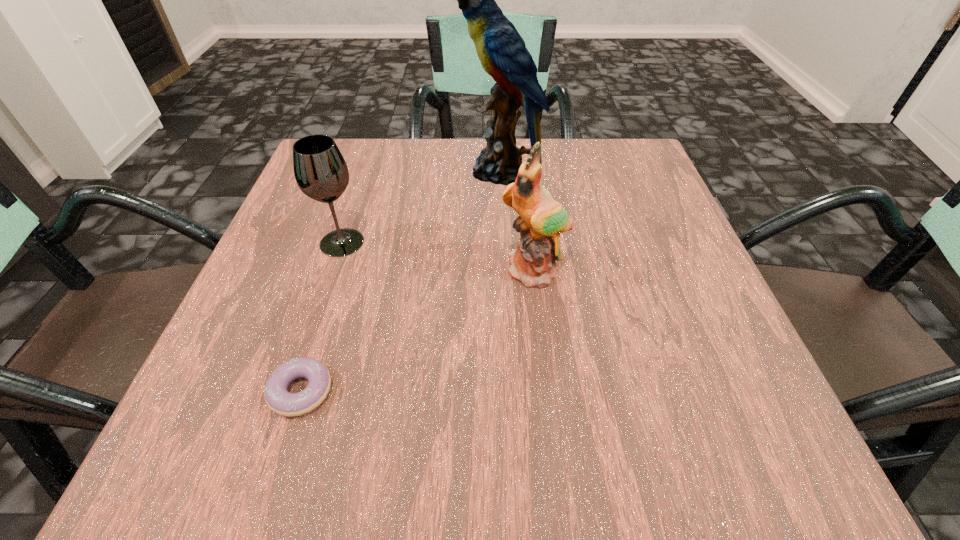
This screenshot has width=960, height=540. I want to click on free space between the shortest object and the shorter parrot, so pyautogui.click(x=418, y=331).

What are the coordinates of `free space that is in between the nearer parrot and the second shortest object` in the screenshot? It's located at (438, 256).

What are the coordinates of `free space between the third tallest object and the doughnut` in the screenshot? It's located at (322, 316).

You are a GUI agent. You are given a task and a screenshot of the screen. Output one action in this format:
    pyautogui.click(x=<x>, y=<y>)
    Task: Click on the unoccupied position between the taller parrot and the wineglass
    
    Given the screenshot: What is the action you would take?
    pyautogui.click(x=421, y=207)

The width and height of the screenshot is (960, 540). I want to click on object that is the second closest to the third tallest object, so click(x=279, y=400).

The image size is (960, 540). What are the coordinates of `object that is the second closest to the nearer parrot` in the screenshot? It's located at (320, 170).

Where is `vacant region that satisfies the following two spatial constraints: 1. on the front side of the nearest object; 2. on the left side of the second shortest object`? This screenshot has height=540, width=960. vacant region that satisfies the following two spatial constraints: 1. on the front side of the nearest object; 2. on the left side of the second shortest object is located at coordinates (294, 391).

You are a GUI agent. You are given a task and a screenshot of the screen. Output one action in this format:
    pyautogui.click(x=<x>, y=<y>)
    Task: Click on the free spot that satisfies the following two spatial constraints: 1. on the face of the farther parrot; 2. on the front side of the wineglass
    
    Given the screenshot: What is the action you would take?
    pyautogui.click(x=505, y=242)

Where is `vacant space that satisfies the following two spatial constraints: 1. on the face of the taller parrot; 2. on the front side of the shortest object`? Image resolution: width=960 pixels, height=540 pixels. vacant space that satisfies the following two spatial constraints: 1. on the face of the taller parrot; 2. on the front side of the shortest object is located at coordinates pos(514,391).